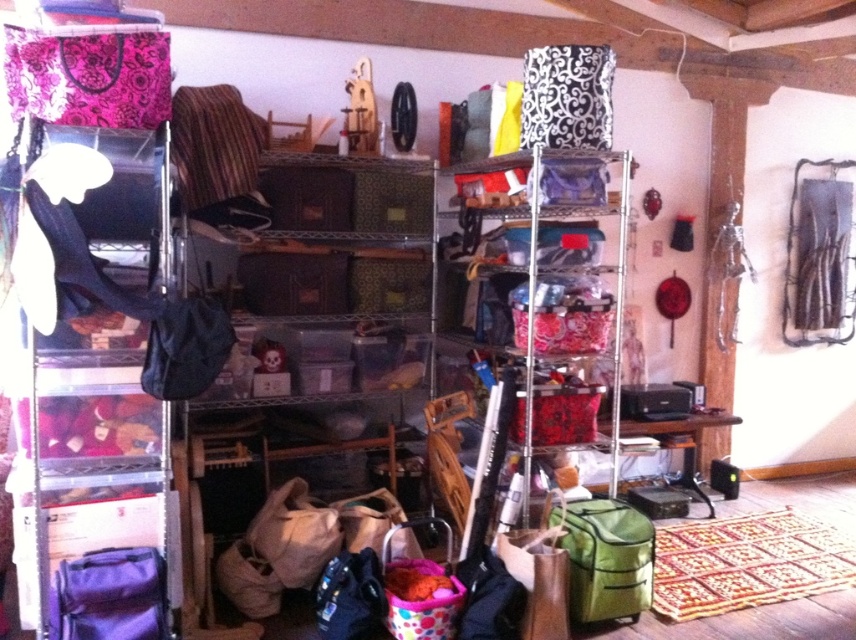
You are organizing the storage area and need to access both the green fabric bag at lower right and the matte purple duffel at lower left. Which one would you move first to reach the other?

The matte purple duffel at lower left is behind the green fabric bag at lower right, so you should move the green fabric bag at lower right first to access the matte purple duffel at lower left.

You are organizing items in the storage area and need to place a new item in the exact location where the green fabric bag at lower right is currently located. What are the coordinates of the spot where you should place the new item?

The coordinates for the green fabric bag at lower right are at point (605, 557). Place the new item there.